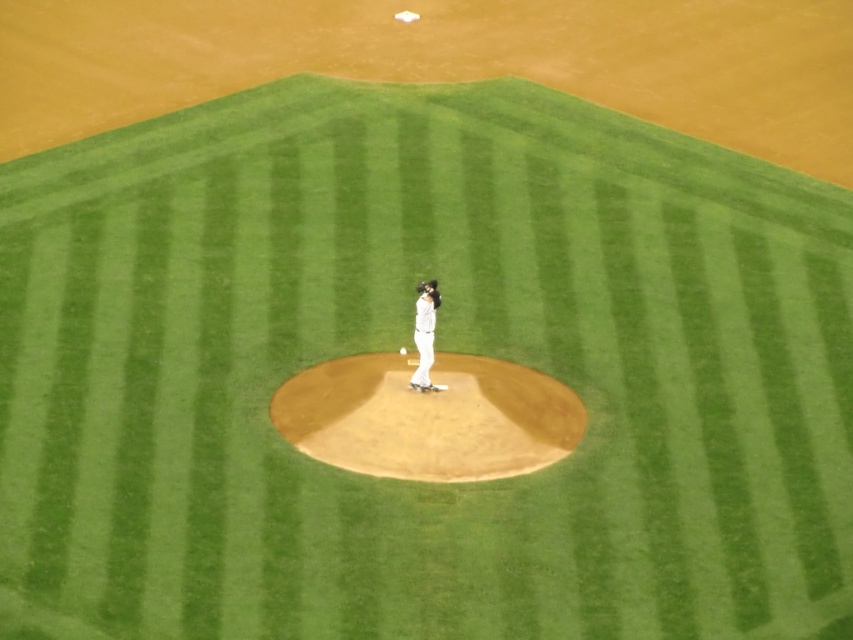
Between point (431, 282) and point (401, 348), which one is positioned behind?

Positioned behind is point (401, 348).

Does dark brown leather glove at center have a greater width compared to white matte baseball at center?

Yes, dark brown leather glove at center is wider than white matte baseball at center.

Find the location of a particular element. This screenshot has width=853, height=640. dark brown leather glove at center is located at coordinates (425, 288).

Between white matte baseball pitcher at center and dark brown leather glove at center, which one has more height?

white matte baseball pitcher at center

Who is positioned more to the left, white matte baseball pitcher at center or dark brown leather glove at center?

dark brown leather glove at center

Does point (422, 374) come in front of point (431, 284)?

That is False.

Find the location of a particular element. This screenshot has height=640, width=853. white matte baseball pitcher at center is located at coordinates (424, 333).

From the picture: Can you confirm if brown dirt mound at center is positioned to the right of dark brown leather glove at center?

Correct, you'll find brown dirt mound at center to the right of dark brown leather glove at center.

Can you confirm if brown dirt mound at center is wider than dark brown leather glove at center?

Correct, the width of brown dirt mound at center exceeds that of dark brown leather glove at center.

Does point (276, 397) lie behind point (433, 282)?

Yes, it is behind point (433, 282).

Where is `brown dirt mound at center`? brown dirt mound at center is located at coordinates (428, 417).